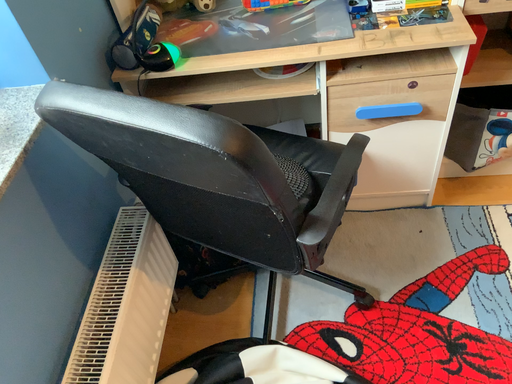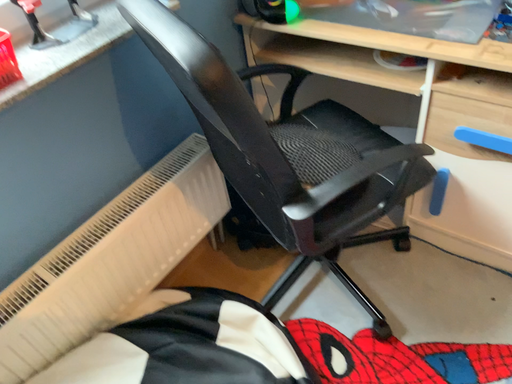
Question: Which way did the camera rotate in the video?

Choices:
 (A) rotated right
 (B) rotated left

Answer: (B)